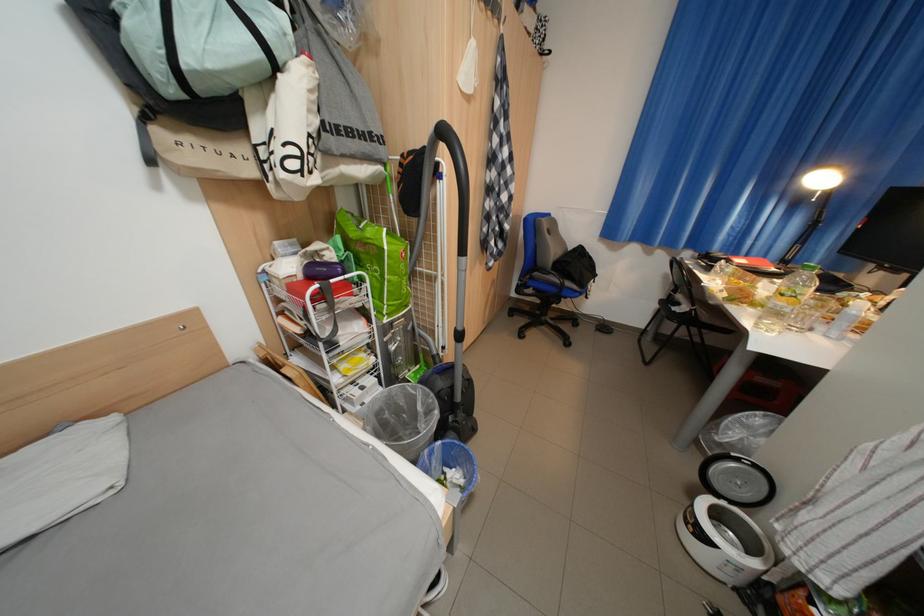
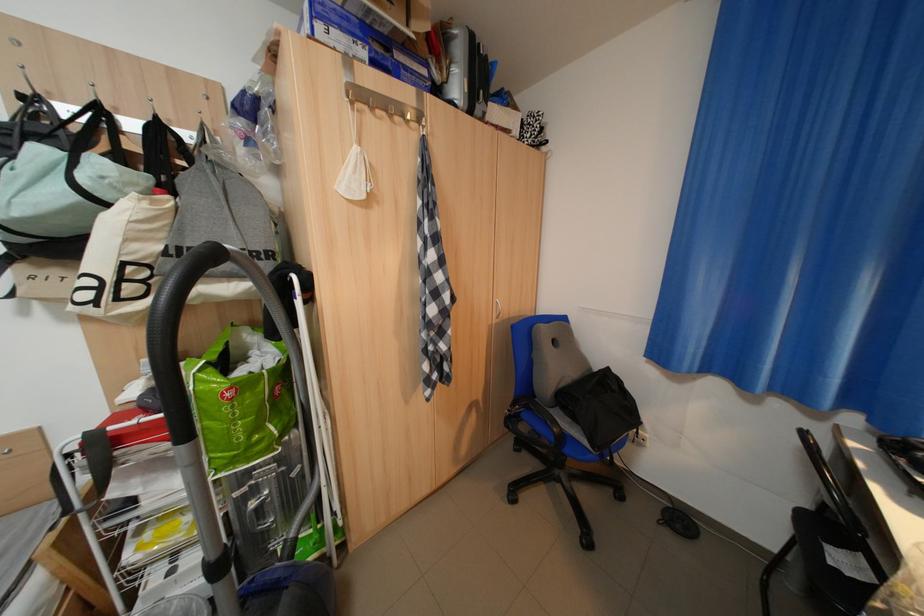
From the picture: Which direction would the cameraman need to move to produce the second image?

The cameraman walked toward right, forward.